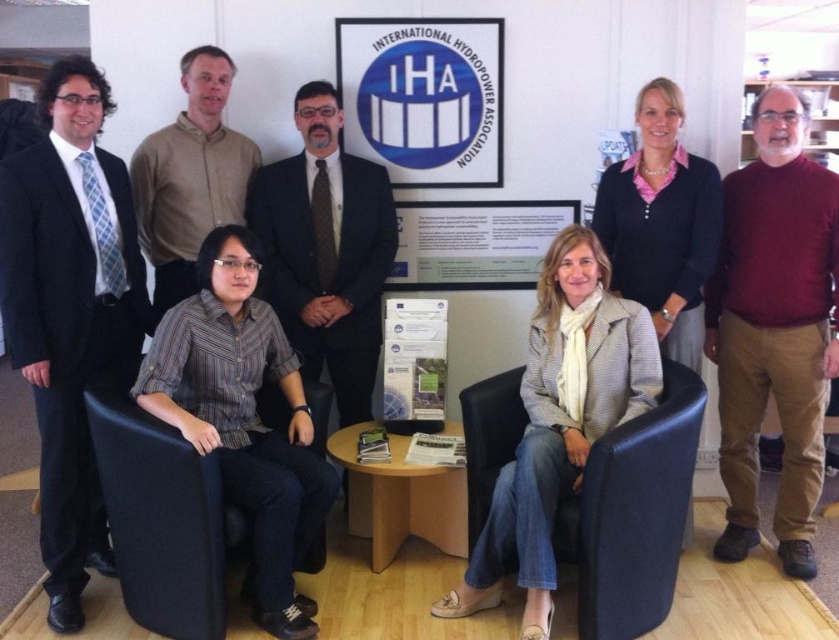
Between point (784, 209) and point (209, 545), which one is positioned in front?

Positioned in front is point (209, 545).

Does maroon sweater at right have a larger size compared to black fabric armchair at lower left?

Correct, maroon sweater at right is larger in size than black fabric armchair at lower left.

Identify the location of maroon sweater at right. (774, 326).

Consider the image. Can you confirm if matte black suit at left is wider than brown shirt at upper center?

No, matte black suit at left is not wider than brown shirt at upper center.

Does matte black suit at left have a lesser width compared to brown shirt at upper center?

Indeed, matte black suit at left has a lesser width compared to brown shirt at upper center.

Image resolution: width=839 pixels, height=640 pixels. Describe the element at coordinates (69, 310) in the screenshot. I see `matte black suit at left` at that location.

Find the location of `matte black suit at left`. matte black suit at left is located at coordinates (69, 310).

Between point (787, 467) and point (197, 157), which one is positioned behind?

Point (197, 157)

Who is higher up, maroon sweater at right or brown shirt at upper center?

Positioned higher is brown shirt at upper center.

What do you see at coordinates (774, 326) in the screenshot? I see `maroon sweater at right` at bounding box center [774, 326].

Locate an element on the screen. This screenshot has height=640, width=839. maroon sweater at right is located at coordinates (774, 326).